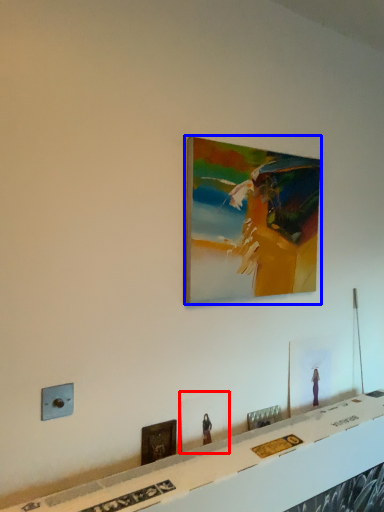
Question: Which object appears closest to the camera in this image, picture frame (highlighted by a red box) or picture frame (highlighted by a blue box)?

Choices:
 (A) picture frame
 (B) picture frame

Answer: (B)